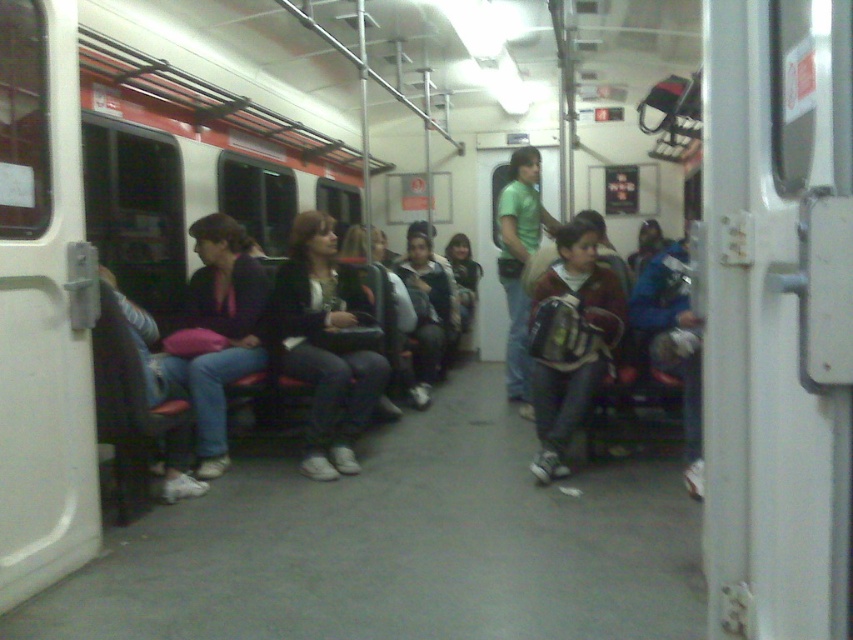
Between point (338, 400) and point (587, 390), which one is positioned in front?

Point (587, 390) is in front.

Which is more to the left, matte black jacket at center or dark brown backpack at center?

matte black jacket at center is more to the left.

What are the coordinates of `matte black jacket at center` in the screenshot? It's located at (323, 344).

Where is `matte black jacket at center`? Image resolution: width=853 pixels, height=640 pixels. matte black jacket at center is located at coordinates (323, 344).

Does dark brown backpack at center have a lesser height compared to matte black jacket at left?

Correct, dark brown backpack at center is not as tall as matte black jacket at left.

Is point (579, 227) positioned in front of point (213, 449)?

No, it is not.

Find the location of `dark brown backpack at center`. dark brown backpack at center is located at coordinates (572, 340).

Identify the location of dark brown backpack at center. This screenshot has width=853, height=640. (572, 340).

Who is shorter, matte black jacket at center or matte black jacket at left?

Standing shorter between the two is matte black jacket at left.

Between point (339, 285) and point (262, 308), which one is positioned in front?

Point (262, 308) is more forward.

Where is `matte black jacket at center`? matte black jacket at center is located at coordinates (323, 344).